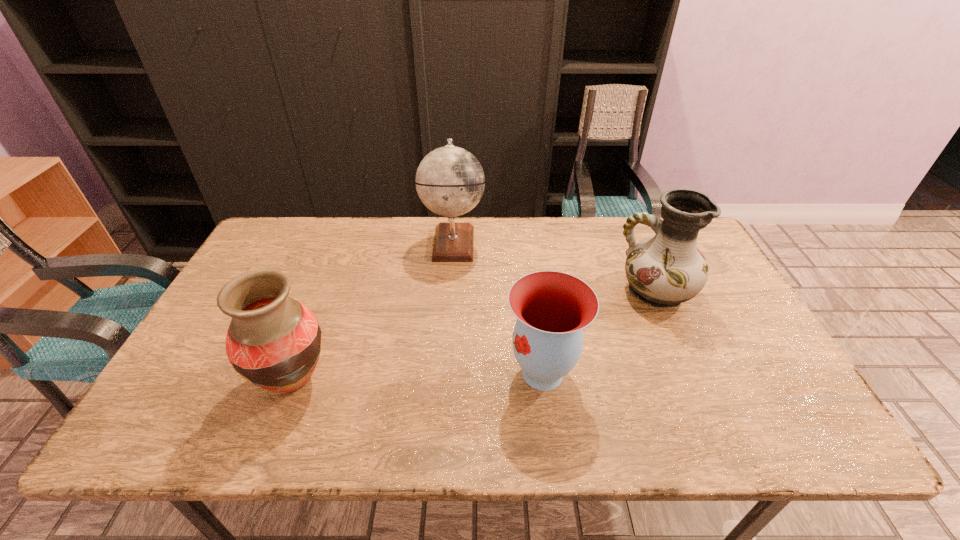
Select which object is the closest to the leftmost object. Please provide its 2D coordinates. Your answer should be formatted as a tuple, i.e. [(x, y)], where the tuple contains the x and y coordinates of a point satisfying the conditions above.

[(450, 181)]

Locate an element on the screen. The width and height of the screenshot is (960, 540). object that can be found as the closest to the leftmost object is located at coordinates (450, 181).

Locate which vase is the second closest to the leftmost object. Please provide its 2D coordinates. Your answer should be formatted as a tuple, i.e. [(x, y)], where the tuple contains the x and y coordinates of a point satisfying the conditions above.

[(665, 270)]

The height and width of the screenshot is (540, 960). Find the location of `vase that stands as the closest to the shortest object`. vase that stands as the closest to the shortest object is located at coordinates (665, 270).

At what (x,y) coordinates should I click in order to perform the action: click on blank space that satisfies the following two spatial constraints: 1. on the back side of the shortest object; 2. on the left side of the leftmost object. Please return your answer as a coordinate pair (x, y). The height and width of the screenshot is (540, 960). Looking at the image, I should click on (296, 373).

This screenshot has width=960, height=540. In order to click on vacant space that satisfies the following two spatial constraints: 1. on the back side of the rightmost vase; 2. on the right side of the leftmost object in this screenshot , I will do `click(327, 291)`.

This screenshot has height=540, width=960. In order to click on free space that satisfies the following two spatial constraints: 1. on the back side of the shortest vase; 2. on the right side of the leftmost object in this screenshot , I will do `click(296, 373)`.

You are a GUI agent. You are given a task and a screenshot of the screen. Output one action in this format:
    pyautogui.click(x=<x>, y=<y>)
    Task: Click on the vacant region that satisfies the following two spatial constraints: 1. on the back side of the shortest object; 2. on the right side of the leftmost vase
    The image size is (960, 540).
    Given the screenshot: What is the action you would take?
    pyautogui.click(x=296, y=373)

Locate an element on the screen. free location that satisfies the following two spatial constraints: 1. at the equator of the farthest object; 2. on the left side of the farthest vase is located at coordinates (450, 291).

Identify the location of free space that satisfies the following two spatial constraints: 1. at the equator of the farthest object; 2. on the back side of the shortest vase. This screenshot has height=540, width=960. (444, 373).